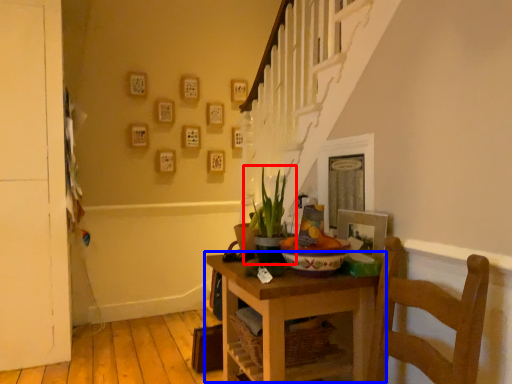
Question: Which object appears farthest to the camera in this image, houseplant (highlighted by a red box) or table (highlighted by a blue box)?

Choices:
 (A) houseplant
 (B) table

Answer: (A)